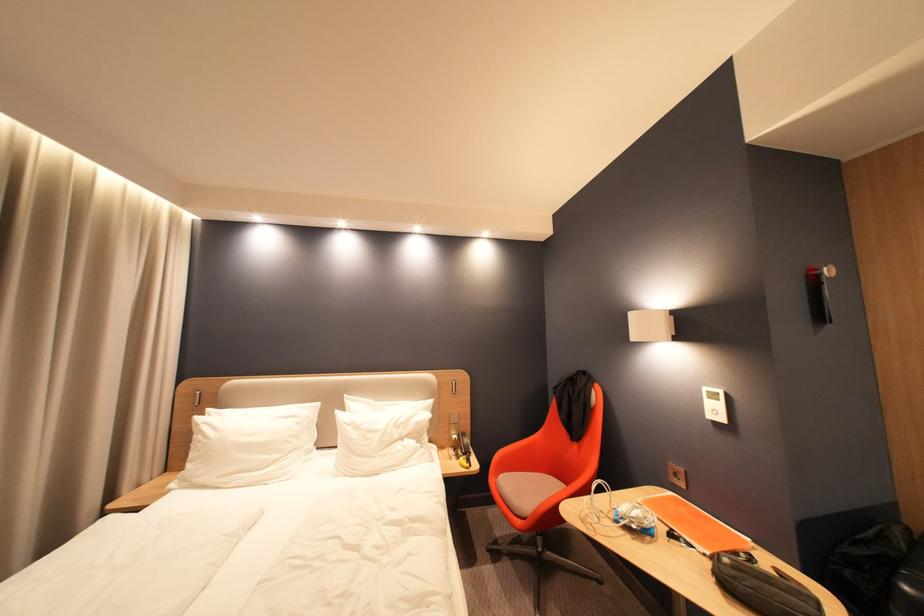
The location [601,506] corresponds to which object?

This point indicates the white charging cable.